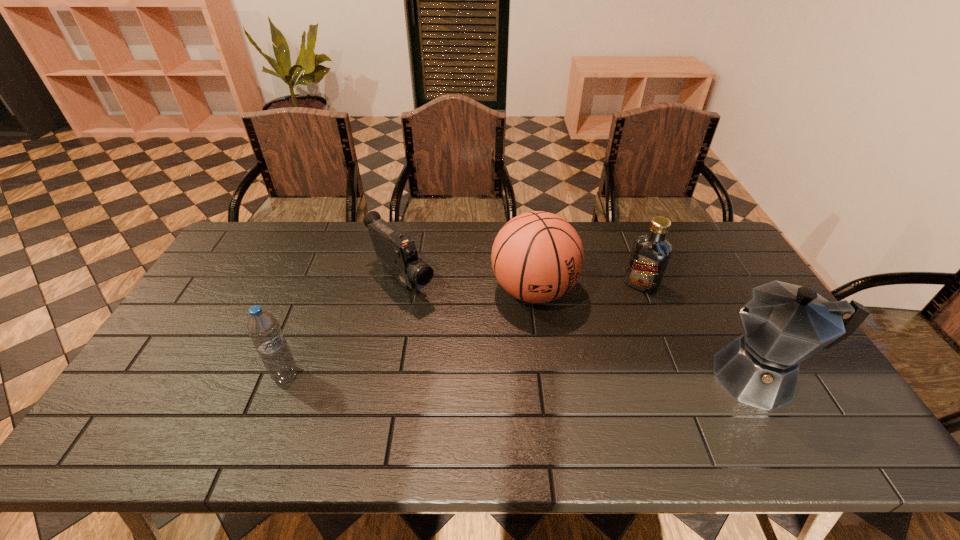
This screenshot has height=540, width=960. Find the location of `basketball that is at the far edge`. basketball that is at the far edge is located at coordinates (537, 257).

You are a GUI agent. You are given a task and a screenshot of the screen. Output one action in this format:
    pyautogui.click(x=<x>, y=<y>)
    Task: Click on the water bottle at the near edge
    The image size is (960, 540).
    Given the screenshot: What is the action you would take?
    pyautogui.click(x=263, y=328)

The image size is (960, 540). Identify the location of coffeepot that is at the near edge. (784, 324).

Locate an element on the screen. object positioned at the right edge is located at coordinates (784, 324).

Where is `object at the near right corner`? The height and width of the screenshot is (540, 960). object at the near right corner is located at coordinates (784, 324).

Locate an element on the screen. The width and height of the screenshot is (960, 540). vacant space at the far edge of the desktop is located at coordinates (346, 232).

At what (x,y) coordinates should I click in order to perform the action: click on free space at the near edge of the desktop. Please return your answer as a coordinate pair (x, y). Looking at the image, I should click on (702, 401).

Image resolution: width=960 pixels, height=540 pixels. Find the location of `vacant space at the left edge of the desktop`. vacant space at the left edge of the desktop is located at coordinates (204, 364).

In the image, there is a desktop. Identify the location of vacant space at the right edge. The image size is (960, 540). (799, 381).

Where is `vacant space at the far left corner of the desktop`? The width and height of the screenshot is (960, 540). vacant space at the far left corner of the desktop is located at coordinates (276, 223).